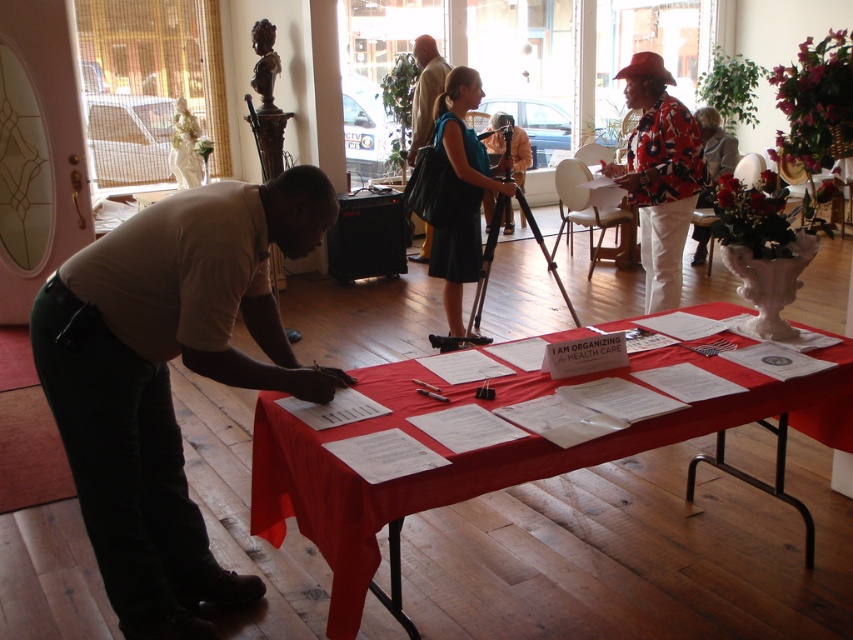
Question: Which point is closer to the camera taking this photo?

Choices:
 (A) [x=80, y=316]
 (B) [x=433, y=262]
 (C) [x=410, y=385]

Answer: (A)

Question: Can you confirm if red cloth-covered table at center is positioned to the right of light beige suit at center?

Choices:
 (A) no
 (B) yes

Answer: (B)

Question: Which object is closer to the camera taking this photo?

Choices:
 (A) light beige suit at center
 (B) red cloth-covered table at center

Answer: (B)

Question: Among these objects, which one is nearest to the camera?

Choices:
 (A) floral-patterned fabric at center
 (B) blue fabric dress at center
 (C) light beige suit at center

Answer: (A)

Question: Does light brown shirt at left have a lesser width compared to red cloth-covered table at center?

Choices:
 (A) no
 (B) yes

Answer: (B)

Question: Is blue fabric dress at center positioned before light beige suit at center?

Choices:
 (A) no
 (B) yes

Answer: (B)